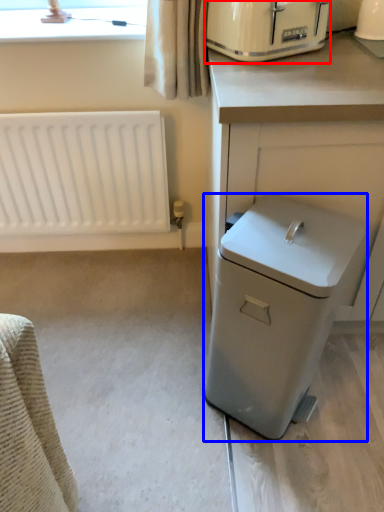
Question: Among these objects, which one is nearest to the camera, home appliance (highlighted by a red box) or dish washer (highlighted by a blue box)?

Choices:
 (A) home appliance
 (B) dish washer

Answer: (B)